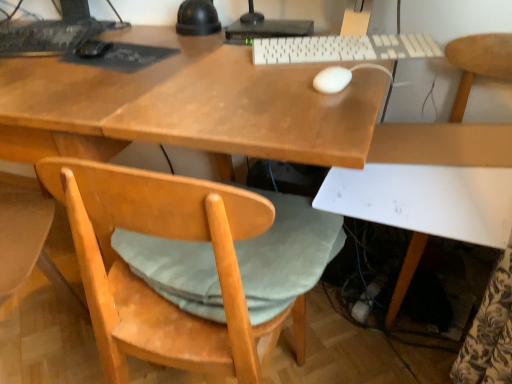
Question: In which direction should I rotate to look at white matte mouse at center, the 1th mouse when ordered from right to left?

Choices:
 (A) left
 (B) right

Answer: (B)

Question: Should I look upward or downward to see dark gray matte mousepad at upper left?

Choices:
 (A) down
 (B) up

Answer: (B)

Question: Is the position of dark gray matte mousepad at upper left less distant than that of black matte mouse at upper left, which ranks as the second mouse in front-to-back order?

Choices:
 (A) no
 (B) yes

Answer: (B)

Question: Can you confirm if dark gray matte mousepad at upper left is smaller than black matte mouse at upper left, which ranks as the second mouse in front-to-back order?

Choices:
 (A) no
 (B) yes

Answer: (A)

Question: From the image's perspective, is dark gray matte mousepad at upper left under black matte mouse at upper left, which ranks as the second mouse in front-to-back order?

Choices:
 (A) no
 (B) yes

Answer: (B)

Question: Can we say dark gray matte mousepad at upper left lies outside black matte mouse at upper left, which appears as the 2th mouse when viewed from the right?

Choices:
 (A) yes
 (B) no

Answer: (A)

Question: Is dark gray matte mousepad at upper left not close to black matte mouse at upper left, positioned as the first mouse in back-to-front order?

Choices:
 (A) no
 (B) yes

Answer: (A)

Question: From a real-world perspective, is dark gray matte mousepad at upper left located higher than black matte mouse at upper left, arranged as the 1th mouse when viewed from the left?

Choices:
 (A) yes
 (B) no

Answer: (B)

Question: Is white plastic keyboard at center, which is the second computer keyboard in left-to-right order, positioned before light wood/rough chair at lower left?

Choices:
 (A) no
 (B) yes

Answer: (A)

Question: From the image's perspective, does white plastic keyboard at center, the first computer keyboard in the right-to-left sequence, appear lower than light wood/rough chair at lower left?

Choices:
 (A) no
 (B) yes

Answer: (A)

Question: Is white plastic keyboard at center, which is the second computer keyboard in left-to-right order, at the right side of light wood/rough chair at lower left?

Choices:
 (A) no
 (B) yes

Answer: (B)

Question: Can you confirm if white plastic keyboard at center, which is the second computer keyboard in left-to-right order, is bigger than light wood/rough chair at lower left?

Choices:
 (A) no
 (B) yes

Answer: (A)

Question: Can you confirm if white plastic keyboard at center, which is the second computer keyboard in left-to-right order, is thinner than light wood/rough chair at lower left?

Choices:
 (A) no
 (B) yes

Answer: (B)

Question: From a real-world perspective, is white plastic keyboard at center, the first computer keyboard in the right-to-left sequence, located higher than light wood/rough chair at lower left?

Choices:
 (A) no
 (B) yes

Answer: (B)

Question: Does white matte chair at lower right have a larger size compared to black matte keyboard at upper left, the second computer keyboard from the right?

Choices:
 (A) yes
 (B) no

Answer: (A)